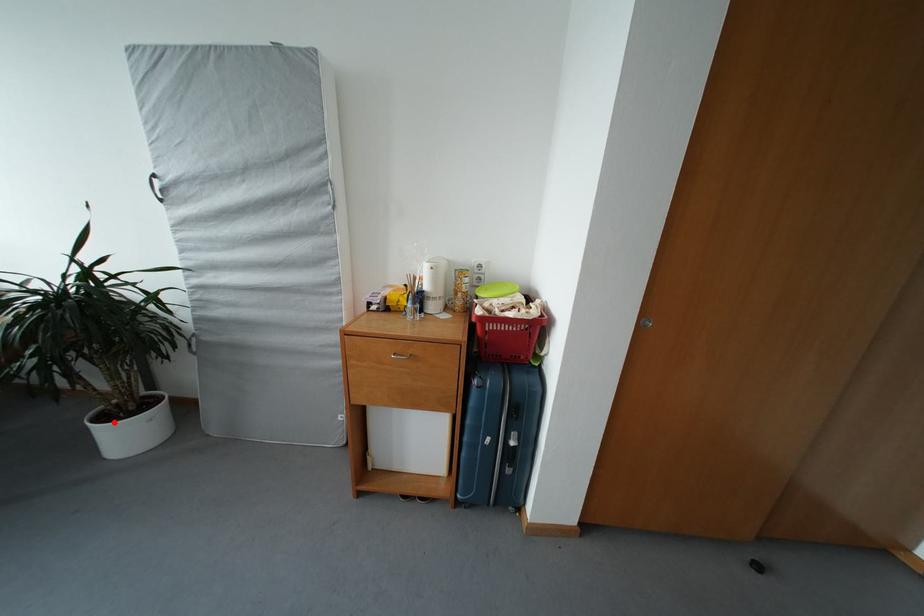
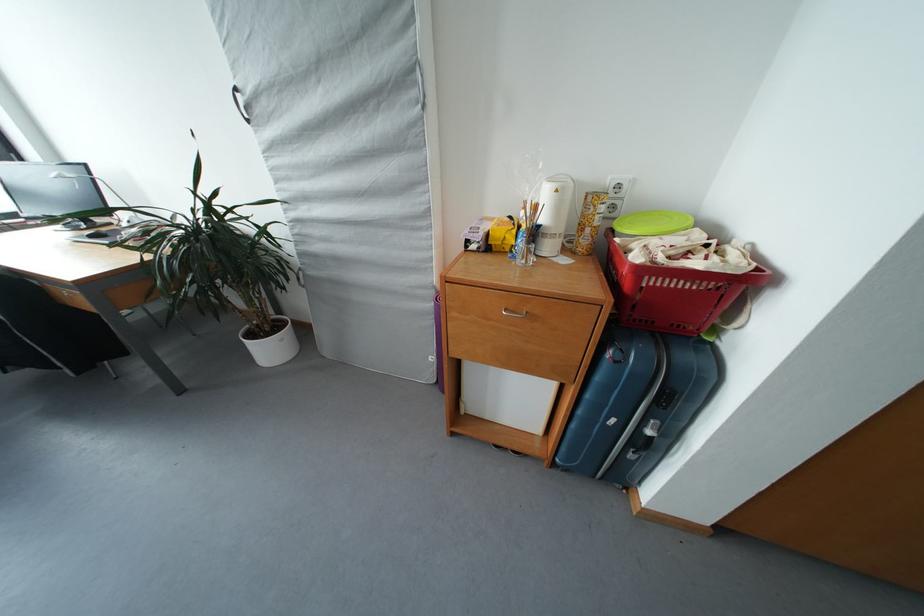
Question: I am providing you with two images of the same scene from different viewpoints. A red point is marked on the first image. At the location where the point appears in image 1, is it still visible in image 2?

Choices:
 (A) Yes
 (B) No

Answer: (A)